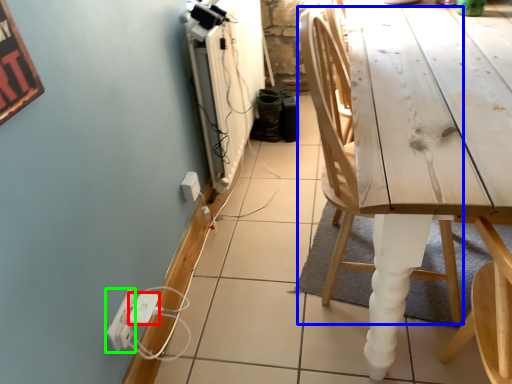
Question: Based on their relative distances, which object is farther from extension cord (highlighted by a red box)? Choose from chair (highlighted by a blue box) and electric outlet (highlighted by a green box).

Choices:
 (A) chair
 (B) electric outlet

Answer: (A)